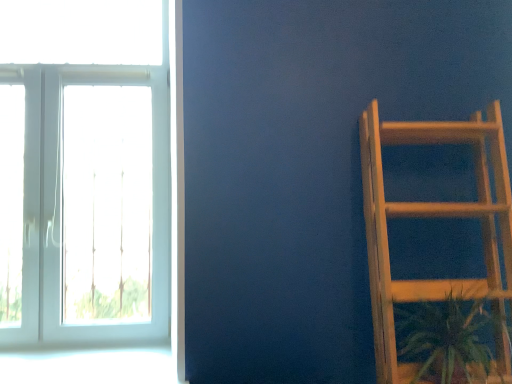
Describe the element at coordinates (452, 334) in the screenshot. The width and height of the screenshot is (512, 384). I see `green leafy plant at lower right` at that location.

This screenshot has height=384, width=512. Describe the element at coordinates (431, 216) in the screenshot. I see `wooden ladder at right` at that location.

Where is `white glass window at left`? Image resolution: width=512 pixels, height=384 pixels. white glass window at left is located at coordinates (123, 240).

In the scene shown: How distant is green leafy plant at lower right from wooden ladder at right?

green leafy plant at lower right and wooden ladder at right are 7.37 inches apart.

From a real-world perspective, is green leafy plant at lower right positioned above or below wooden ladder at right?

green leafy plant at lower right is situated lower than wooden ladder at right in the real world.

Between green leafy plant at lower right and wooden ladder at right, which one is positioned in front?

wooden ladder at right is in front.

Which of these two, green leafy plant at lower right or wooden ladder at right, stands shorter?

green leafy plant at lower right.

Can you tell me how much wooden ladder at right and green leafy plant at lower right differ in facing direction?

0.000544 degrees separate the facing orientations of wooden ladder at right and green leafy plant at lower right.

Considering the relative positions of wooden ladder at right and green leafy plant at lower right in the image provided, is wooden ladder at right in front of green leafy plant at lower right?

Yes, it is.

Who is smaller, wooden ladder at right or green leafy plant at lower right?

With smaller size is green leafy plant at lower right.

Could you tell me if wooden ladder at right is turned towards green leafy plant at lower right?

Yes, wooden ladder at right is facing green leafy plant at lower right.

Is green leafy plant at lower right at the back of white glass window at left?

white glass window at left does not have its back to green leafy plant at lower right.

How much distance is there between white glass window at left and green leafy plant at lower right?

1.27 meters.

Consider the image. Is white glass window at left far away from green leafy plant at lower right?

That's right, there is a large distance between white glass window at left and green leafy plant at lower right.

From the image's perspective, is white glass window at left beneath green leafy plant at lower right?

No, from the image's perspective, white glass window at left is not below green leafy plant at lower right.

Is wooden ladder at right directly adjacent to white glass window at left?

There is a gap between wooden ladder at right and white glass window at left.

Is wooden ladder at right wider than white glass window at left?

Yes, wooden ladder at right is wider than white glass window at left.

Can you confirm if wooden ladder at right is positioned to the left of white glass window at left?

Incorrect, wooden ladder at right is not on the left side of white glass window at left.

Is point (453, 335) positioned after point (61, 261)?

No, it is not.

Can you confirm if green leafy plant at lower right is positioned to the left of white glass window at left?

No.

Is green leafy plant at lower right shorter than white glass window at left?

Yes.

Is white glass window at left positioned far away from wooden ladder at right?

Yes, white glass window at left is far from wooden ladder at right.

Considering the positions of point (164, 134) and point (386, 136), is point (164, 134) closer or farther from the camera than point (386, 136)?

Clearly, point (164, 134) is more distant from the camera than point (386, 136).

Which of these two, white glass window at left or wooden ladder at right, stands shorter?

wooden ladder at right.

From the image's perspective, is white glass window at left beneath wooden ladder at right?

No.

Identify the location of houseplant located below the wooden ladder at right (from the image's perspective). (452, 334).

You are a GUI agent. You are given a task and a screenshot of the screen. Output one action in this format:
    pyautogui.click(x=<x>, y=<y>)
    Task: Click on the furniture above the green leafy plant at lower right (from a real-world perspective)
    Image resolution: width=512 pixels, height=384 pixels.
    Given the screenshot: What is the action you would take?
    pyautogui.click(x=431, y=216)

Estimate the real-world distances between objects in this image. Which object is closer to white glass window at left, green leafy plant at lower right or wooden ladder at right?

Based on the image, wooden ladder at right appears to be nearer to white glass window at left.

Looking at the image, which one is located closer to white glass window at left, wooden ladder at right or green leafy plant at lower right?

The object closer to white glass window at left is wooden ladder at right.

From the image, which object appears to be farther from wooden ladder at right, white glass window at left or green leafy plant at lower right?

white glass window at left lies further to wooden ladder at right than the other object.

When comparing their distances from green leafy plant at lower right, does wooden ladder at right or white glass window at left seem further?

The object further to green leafy plant at lower right is white glass window at left.

Estimate the real-world distances between objects in this image. Which object is closer to wooden ladder at right, green leafy plant at lower right or white glass window at left?

Among the two, green leafy plant at lower right is located nearer to wooden ladder at right.

Based on their spatial positions, is white glass window at left or wooden ladder at right closer to green leafy plant at lower right?

wooden ladder at right.

Locate an element on the screen. The image size is (512, 384). furniture between white glass window at left and green leafy plant at lower right is located at coordinates (431, 216).